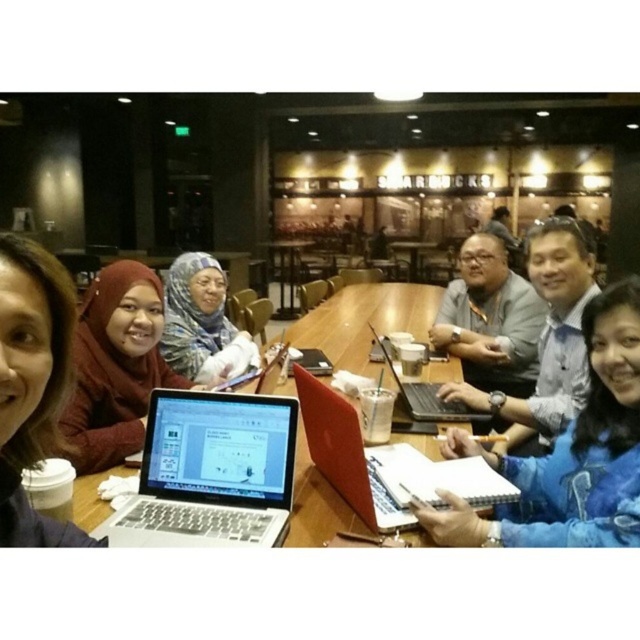
Is blue denim jacket at lower right closer to camera compared to matte blue hijab at center?

Yes, it is.

Describe the element at coordinates (566, 454) in the screenshot. This screenshot has width=640, height=640. I see `blue denim jacket at lower right` at that location.

Where is `blue denim jacket at lower right`? Image resolution: width=640 pixels, height=640 pixels. blue denim jacket at lower right is located at coordinates (566, 454).

Does matte black laptop at lower left have a lesser height compared to matte black hijab at center?

Indeed, matte black laptop at lower left has a lesser height compared to matte black hijab at center.

Who is positioned more to the left, matte black laptop at lower left or matte black hijab at center?

From the viewer's perspective, matte black hijab at center appears more on the left side.

Does point (28, 458) come closer to viewer compared to point (108, 438)?

Yes, point (28, 458) is in front of point (108, 438).

You are a GUI agent. You are given a task and a screenshot of the screen. Output one action in this format:
    pyautogui.click(x=<x>, y=<y>)
    Task: Click on the matte black laptop at lower left
    The height and width of the screenshot is (640, 640).
    Given the screenshot: What is the action you would take?
    pyautogui.click(x=32, y=384)

Measure the distance between matte blue hijab at center and matte silver laptop at center.

matte blue hijab at center and matte silver laptop at center are 36.81 inches apart.

Can you confirm if matte blue hijab at center is smaller than matte silver laptop at center?

Correct, matte blue hijab at center occupies less space than matte silver laptop at center.

Who is more forward, (232, 340) or (374, 310)?

Point (232, 340)

Identify the location of matte blue hijab at center. (202, 323).